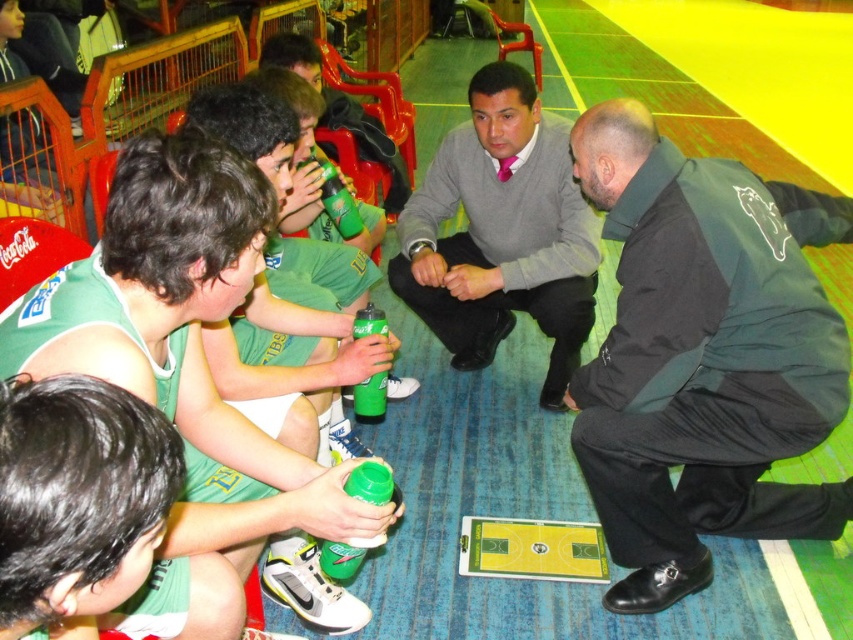
Question: Does green fabric jacket at lower right appear under green jersey at center?

Choices:
 (A) yes
 (B) no

Answer: (B)

Question: Can you confirm if matte green uniform at lower left is positioned below green matte bottle at center?

Choices:
 (A) no
 (B) yes

Answer: (B)

Question: Among these objects, which one is farthest from the camera?

Choices:
 (A) green matte water bottle at center
 (B) green matte bottle at center

Answer: (B)

Question: Which object is positioned closest to the green matte bottle at lower center?

Choices:
 (A) green jersey at center
 (B) green matte bottle at center
 (C) matte green uniform at lower left

Answer: (A)

Question: Which object appears farthest from the camera in this image?

Choices:
 (A) matte green uniform at lower left
 (B) green jersey at center
 (C) green fabric jacket at lower right

Answer: (C)

Question: Considering the relative positions of gray sweater at center and green matte bottle at lower center in the image provided, where is gray sweater at center located with respect to green matte bottle at lower center?

Choices:
 (A) above
 (B) below

Answer: (A)